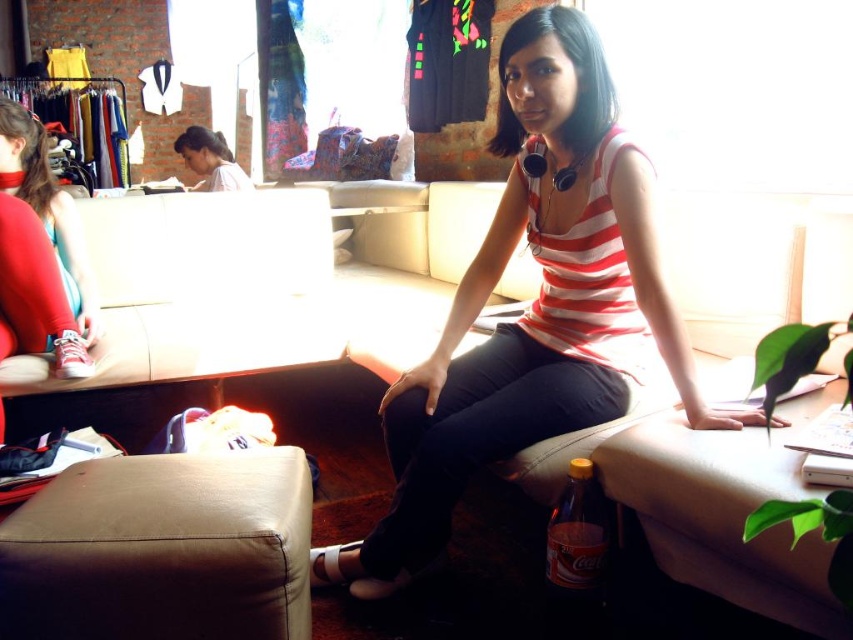
Question: Which point is closer to the camera taking this photo?

Choices:
 (A) click(x=25, y=358)
 (B) click(x=33, y=138)
 (C) click(x=483, y=358)
 (D) click(x=163, y=545)

Answer: (D)

Question: Among these objects, which one is farthest from the camera?

Choices:
 (A) brown glass bottle at lower right
 (B) dark brown hair at upper left

Answer: (B)

Question: Is striped fabric top at center smaller than dark brown hair at upper left?

Choices:
 (A) yes
 (B) no

Answer: (B)

Question: Estimate the real-world distances between objects in this image. Which object is farther from the striped fabric top at center?

Choices:
 (A) dark brown hair at upper left
 (B) matte red sneakers at lower left
 (C) brown glass bottle at lower right
 (D) beige leather couch at lower left

Answer: (A)

Question: Does leather ottoman at lower left appear on the right side of matte red sneakers at lower left?

Choices:
 (A) no
 (B) yes

Answer: (B)

Question: Is leather ottoman at lower left wider than beige leather couch at lower left?

Choices:
 (A) yes
 (B) no

Answer: (B)